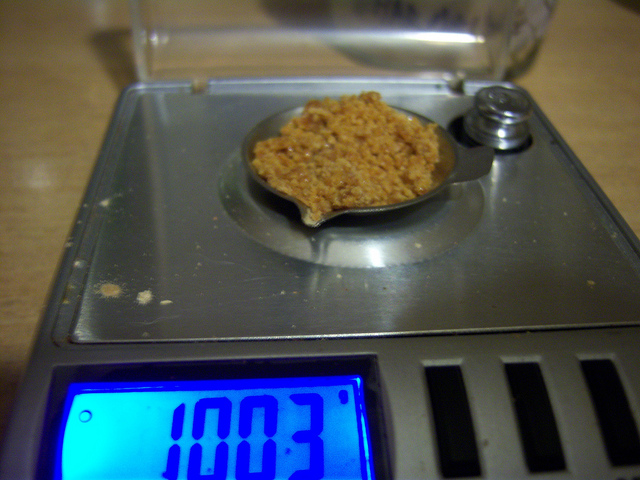
The height and width of the screenshot is (480, 640). In order to click on illuminated screen on left side of scale front in this screenshot , I will do `click(123, 441)`.